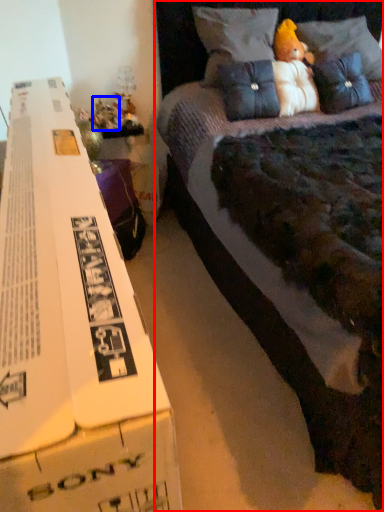
Question: Which of the following is the farthest to the observer, bed (highlighted by a red box) or toy (highlighted by a blue box)?

Choices:
 (A) bed
 (B) toy

Answer: (B)